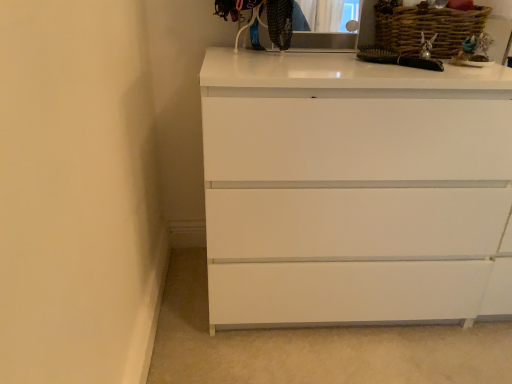
Describe the element at coordinates (324, 26) in the screenshot. The height and width of the screenshot is (384, 512). I see `matte black medicine cabinet at upper center` at that location.

Locate an element on the screen. matte black medicine cabinet at upper center is located at coordinates (324, 26).

Does matte black medicine cabinet at upper center turn towards white glossy chest of drawers at center?

No, matte black medicine cabinet at upper center is not facing towards white glossy chest of drawers at center.

From the image's perspective, which is above, matte black medicine cabinet at upper center or white glossy chest of drawers at center?

matte black medicine cabinet at upper center, from the image's perspective.

Is white glossy chest of drawers at center surrounded by matte black medicine cabinet at upper center?

Actually, white glossy chest of drawers at center is outside matte black medicine cabinet at upper center.

What are the coordinates of `chest of drawers that appears on the right of matte black medicine cabinet at upper center` in the screenshot? It's located at (355, 190).

Based on their positions, is white glossy chest of drawers at center located to the left or right of woven brown basket at upper right?

white glossy chest of drawers at center is to the left of woven brown basket at upper right.

Between white glossy chest of drawers at center and woven brown basket at upper right, which one has smaller size?

With smaller size is woven brown basket at upper right.

From a real-world perspective, relative to woven brown basket at upper right, is white glossy chest of drawers at center vertically above or below?

In terms of real-world spatial position, white glossy chest of drawers at center is below woven brown basket at upper right.

Considering the relative sizes of white glossy chest of drawers at center and woven brown basket at upper right in the image provided, is white glossy chest of drawers at center shorter than woven brown basket at upper right?

Incorrect, the height of white glossy chest of drawers at center does not fall short of that of woven brown basket at upper right.

Based on the photo, between matte black medicine cabinet at upper center and woven brown basket at upper right, which one has more height?

Standing taller between the two is matte black medicine cabinet at upper center.

Where is `basket located behind the matte black medicine cabinet at upper center`? The width and height of the screenshot is (512, 384). basket located behind the matte black medicine cabinet at upper center is located at coordinates 426,27.

How many degrees apart are the facing directions of matte black medicine cabinet at upper center and woven brown basket at upper right?

The facing directions of matte black medicine cabinet at upper center and woven brown basket at upper right are 2.97 degrees apart.

From the image's perspective, is matte black medicine cabinet at upper center located above or below woven brown basket at upper right?

matte black medicine cabinet at upper center is situated higher than woven brown basket at upper right in the image.

Is woven brown basket at upper right to the left or to the right of white glossy chest of drawers at center in the image?

woven brown basket at upper right is to the right of white glossy chest of drawers at center.

At what (x,y) coordinates should I click in order to perform the action: click on chest of drawers lying on the left of woven brown basket at upper right. Please return your answer as a coordinate pair (x, y). The width and height of the screenshot is (512, 384). Looking at the image, I should click on (355, 190).

Who is smaller, woven brown basket at upper right or matte black medicine cabinet at upper center?

matte black medicine cabinet at upper center.

Can you confirm if woven brown basket at upper right is shorter than matte black medicine cabinet at upper center?

Yes.

Considering the positions of objects woven brown basket at upper right and matte black medicine cabinet at upper center in the image provided, who is more to the left, woven brown basket at upper right or matte black medicine cabinet at upper center?

From the viewer's perspective, matte black medicine cabinet at upper center appears more on the left side.

At what (x,y) coordinates should I click in order to perform the action: click on chest of drawers located on the right of matte black medicine cabinet at upper center. Please return your answer as a coordinate pair (x, y). The width and height of the screenshot is (512, 384). Looking at the image, I should click on (355, 190).

Looking at this image, considering the relative positions of white glossy chest of drawers at center and matte black medicine cabinet at upper center in the image provided, is white glossy chest of drawers at center to the left of matte black medicine cabinet at upper center from the viewer's perspective?

No, white glossy chest of drawers at center is not to the left of matte black medicine cabinet at upper center.

Does white glossy chest of drawers at center turn towards matte black medicine cabinet at upper center?

No, white glossy chest of drawers at center is not aimed at matte black medicine cabinet at upper center.

Consider the image. Measure the distance from white glossy chest of drawers at center to matte black medicine cabinet at upper center.

20.70 inches.

Identify the location of chest of drawers below the matte black medicine cabinet at upper center (from a real-world perspective). 355,190.

Identify the location of chest of drawers located on the left of woven brown basket at upper right. This screenshot has height=384, width=512. tap(355, 190).

Which object lies nearer to the anchor point matte black medicine cabinet at upper center, woven brown basket at upper right or white glossy chest of drawers at center?

The object closer to matte black medicine cabinet at upper center is woven brown basket at upper right.

Based on their spatial positions, is white glossy chest of drawers at center or matte black medicine cabinet at upper center closer to woven brown basket at upper right?

matte black medicine cabinet at upper center is closer to woven brown basket at upper right.

When comparing their distances from woven brown basket at upper right, does matte black medicine cabinet at upper center or white glossy chest of drawers at center seem closer?

matte black medicine cabinet at upper center.

When comparing their distances from matte black medicine cabinet at upper center, does white glossy chest of drawers at center or woven brown basket at upper right seem further?

white glossy chest of drawers at center is positioned further to the anchor matte black medicine cabinet at upper center.

Which object lies nearer to the anchor point white glossy chest of drawers at center, matte black medicine cabinet at upper center or woven brown basket at upper right?

Among the two, woven brown basket at upper right is located nearer to white glossy chest of drawers at center.

Which object lies nearer to the anchor point white glossy chest of drawers at center, woven brown basket at upper right or matte black medicine cabinet at upper center?

The object closer to white glossy chest of drawers at center is woven brown basket at upper right.

You are a GUI agent. You are given a task and a screenshot of the screen. Output one action in this format:
    pyautogui.click(x=<x>, y=<y>)
    Task: Click on the basket between matte black medicine cabinet at upper center and white glossy chest of drawers at center in the vertical direction
    The height and width of the screenshot is (384, 512).
    Given the screenshot: What is the action you would take?
    pyautogui.click(x=426, y=27)